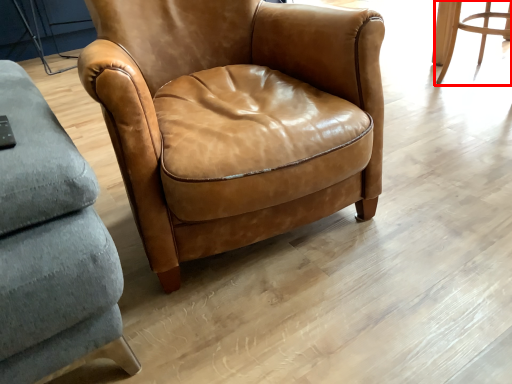
Question: Where is chair (annotated by the red box) located in relation to chair in the image?

Choices:
 (A) right
 (B) left

Answer: (A)